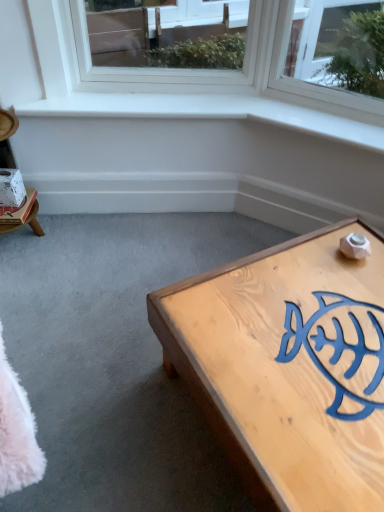
Question: Considering the relative sizes of white paper at left and light wood coffee table at lower right in the image provided, is white paper at left smaller than light wood coffee table at lower right?

Choices:
 (A) no
 (B) yes

Answer: (B)

Question: Considering the relative sizes of white paper at left and light wood coffee table at lower right in the image provided, is white paper at left taller than light wood coffee table at lower right?

Choices:
 (A) yes
 (B) no

Answer: (B)

Question: Is white paper at left looking in the opposite direction of light wood coffee table at lower right?

Choices:
 (A) no
 (B) yes

Answer: (A)

Question: From a real-world perspective, is white paper at left located beneath light wood coffee table at lower right?

Choices:
 (A) yes
 (B) no

Answer: (B)

Question: Is there a large distance between white paper at left and light wood coffee table at lower right?

Choices:
 (A) no
 (B) yes

Answer: (B)

Question: Considering the positions of light wood coffee table at lower right and white paper at left in the image, is light wood coffee table at lower right wider or thinner than white paper at left?

Choices:
 (A) wide
 (B) thin

Answer: (A)

Question: Considering the positions of point (357, 457) and point (3, 199), is point (357, 457) closer or farther from the camera than point (3, 199)?

Choices:
 (A) farther
 (B) closer

Answer: (B)

Question: Would you say light wood coffee table at lower right is to the left or to the right of white paper at left in the picture?

Choices:
 (A) right
 (B) left

Answer: (A)

Question: From a real-world perspective, relative to white paper at left, is light wood coffee table at lower right vertically above or below?

Choices:
 (A) above
 (B) below

Answer: (B)

Question: Looking at the image, does light wood coffee table at lower right seem bigger or smaller compared to white cardboard box at left?

Choices:
 (A) big
 (B) small

Answer: (A)

Question: Considering the positions of light wood coffee table at lower right and white cardboard box at left in the image, is light wood coffee table at lower right taller or shorter than white cardboard box at left?

Choices:
 (A) short
 (B) tall

Answer: (B)

Question: Which is correct: light wood coffee table at lower right is inside white cardboard box at left, or outside of it?

Choices:
 (A) outside
 (B) inside

Answer: (A)

Question: In the image, is light wood coffee table at lower right on the left side or the right side of white cardboard box at left?

Choices:
 (A) left
 (B) right

Answer: (B)

Question: From a real-world perspective, is white cardboard box at left above or below white paper at left?

Choices:
 (A) above
 (B) below

Answer: (B)

Question: Is white cardboard box at left to the left or to the right of white paper at left in the image?

Choices:
 (A) right
 (B) left

Answer: (B)